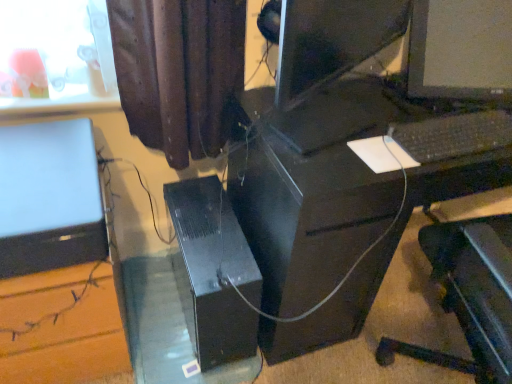
Question: Is black plastic computer tower at center surrounding satin silver laptop at left?

Choices:
 (A) yes
 (B) no

Answer: (B)

Question: Is black plastic computer tower at center positioned before satin silver laptop at left?

Choices:
 (A) yes
 (B) no

Answer: (B)

Question: Can we say black plastic computer tower at center lies outside satin silver laptop at left?

Choices:
 (A) no
 (B) yes

Answer: (B)

Question: Is black plastic computer tower at center bigger than satin silver laptop at left?

Choices:
 (A) no
 (B) yes

Answer: (B)

Question: From the image's perspective, is black plastic computer tower at center below satin silver laptop at left?

Choices:
 (A) no
 (B) yes

Answer: (B)

Question: From a real-world perspective, is satin silver laptop at left above or below black plastic computer tower at center?

Choices:
 (A) below
 (B) above

Answer: (B)

Question: From the image's perspective, is satin silver laptop at left located above or below black plastic computer tower at center?

Choices:
 (A) below
 (B) above

Answer: (B)

Question: Considering the positions of satin silver laptop at left and black plastic computer tower at center in the image, is satin silver laptop at left wider or thinner than black plastic computer tower at center?

Choices:
 (A) thin
 (B) wide

Answer: (A)

Question: Considering the positions of satin silver laptop at left and black plastic computer tower at center in the image, is satin silver laptop at left taller or shorter than black plastic computer tower at center?

Choices:
 (A) tall
 (B) short

Answer: (B)

Question: From a real-world perspective, is black plastic computer desk at center positioned above or below satin silver laptop at left?

Choices:
 (A) below
 (B) above

Answer: (A)

Question: Looking at their shapes, would you say black plastic computer desk at center is wider or thinner than satin silver laptop at left?

Choices:
 (A) thin
 (B) wide

Answer: (B)

Question: Choose the correct answer: Is black plastic computer desk at center inside satin silver laptop at left or outside it?

Choices:
 (A) outside
 (B) inside

Answer: (A)

Question: Is point (377, 119) positioned closer to the camera than point (23, 228)?

Choices:
 (A) farther
 (B) closer

Answer: (A)

Question: From the image's perspective, is black plastic keyboard at center above or below black plastic computer desk at center?

Choices:
 (A) below
 (B) above

Answer: (B)

Question: Considering the positions of black plastic keyboard at center and black plastic computer desk at center in the image, is black plastic keyboard at center wider or thinner than black plastic computer desk at center?

Choices:
 (A) wide
 (B) thin

Answer: (B)